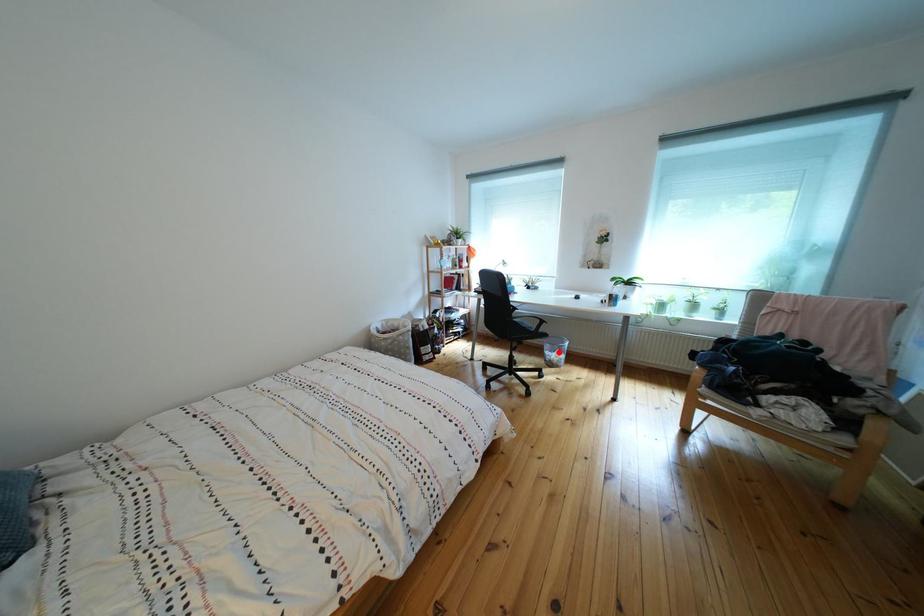
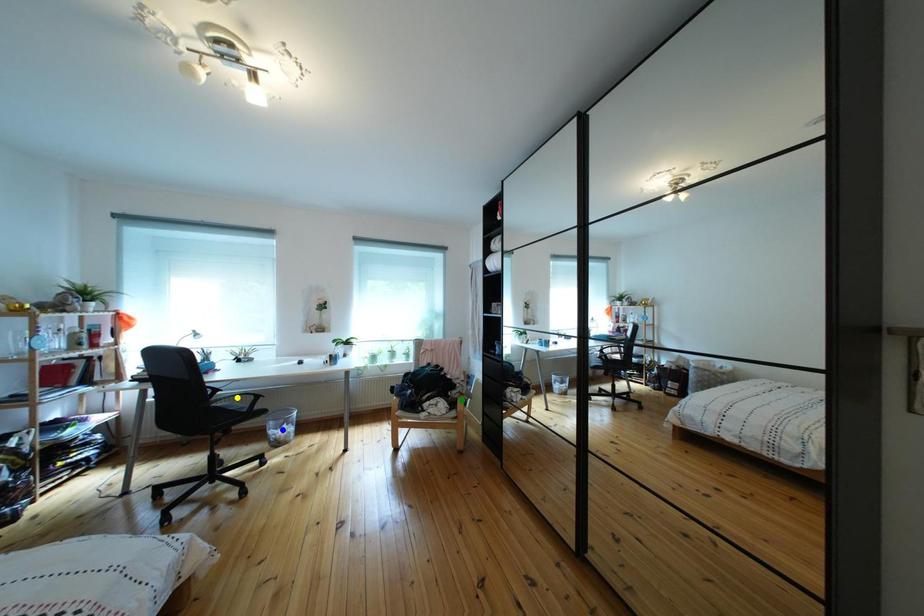
Question: I am providing you with two images of the same scene from different viewpoints. A red point is marked on the first image. You are given multiple points on the second image. In image 2, which mark is for the same physical point as the one in image 1?

Choices:
 (A) green point
 (B) blue point
 (C) yellow point

Answer: (B)